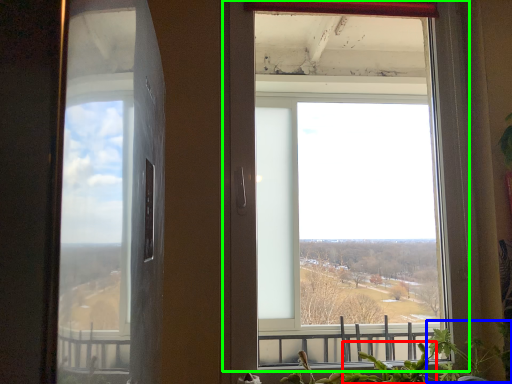
Question: Which is nearer to the plant (highlighted by a red box)? plant (highlighted by a blue box) or window (highlighted by a green box).

Choices:
 (A) plant
 (B) window

Answer: (A)